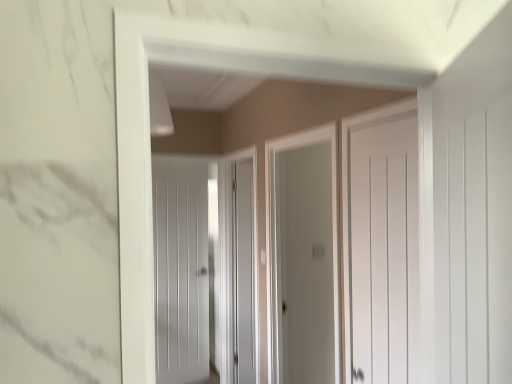
Question: Does white matte door at center, which is the 1th door in front-to-back order, appear on the left side of matte gray screen door at center, arranged as the 2th screen door when viewed from the front?

Choices:
 (A) no
 (B) yes

Answer: (A)

Question: Could matte gray screen door at center, arranged as the 2th screen door when viewed from the front, be considered to be inside white matte door at center, acting as the second door starting from the left?

Choices:
 (A) yes
 (B) no

Answer: (B)

Question: From the image's perspective, is white matte door at center, which is the 1th door in front-to-back order, located beneath matte gray screen door at center, which appears as the 1th screen door when viewed from the left?

Choices:
 (A) yes
 (B) no

Answer: (B)

Question: Can you confirm if white matte door at center, marked as the first door in a right-to-left arrangement, is thinner than matte gray screen door at center, which appears as the 1th screen door when viewed from the left?

Choices:
 (A) no
 (B) yes

Answer: (B)

Question: Is matte gray screen door at center, arranged as the 2th screen door when viewed from the front, at the back of white matte door at center, marked as the first door in a right-to-left arrangement?

Choices:
 (A) no
 (B) yes

Answer: (A)

Question: In the image, is matte gray screen door at center, which appears as the 1th screen door when viewed from the left, positioned in front of or behind white matte door at center, placed as the 2th door when sorted from back to front?

Choices:
 (A) behind
 (B) front

Answer: (A)

Question: Looking at their shapes, would you say matte gray screen door at center, placed as the first screen door when sorted from back to front, is wider or thinner than white matte door at center, which is the 1th door in front-to-back order?

Choices:
 (A) thin
 (B) wide

Answer: (B)

Question: Considering the positions of point (229, 276) and point (385, 349), is point (229, 276) closer or farther from the camera than point (385, 349)?

Choices:
 (A) farther
 (B) closer

Answer: (A)

Question: Looking at the image, does matte gray screen door at center, which appears as the 1th screen door when viewed from the left, seem bigger or smaller compared to white matte door at center, acting as the second door starting from the left?

Choices:
 (A) small
 (B) big

Answer: (B)

Question: Is point (415, 354) closer or farther from the camera than point (254, 243)?

Choices:
 (A) closer
 (B) farther

Answer: (A)

Question: From the image's perspective, is white matte door at center, which is the 1th door in front-to-back order, positioned above or below matte gray screen door at center, arranged as the 2th screen door when viewed from the front?

Choices:
 (A) above
 (B) below

Answer: (A)

Question: Visually, is white matte door at center, marked as the first door in a right-to-left arrangement, positioned to the left or to the right of matte gray screen door at center, marked as the 2th screen door in a right-to-left arrangement?

Choices:
 (A) right
 (B) left

Answer: (A)

Question: Is white matte door at center, acting as the second door starting from the left, in front of or behind matte gray screen door at center, which appears as the 1th screen door when viewed from the left, in the image?

Choices:
 (A) front
 (B) behind

Answer: (A)

Question: In the image, is matte gray screen door at center, placed as the first screen door when sorted from back to front, positioned in front of or behind clear glass door at center, acting as the 1th screen door starting from the front?

Choices:
 (A) behind
 (B) front

Answer: (A)

Question: From their relative heights in the image, would you say matte gray screen door at center, marked as the 2th screen door in a right-to-left arrangement, is taller or shorter than clear glass door at center, marked as the 2th screen door in a left-to-right arrangement?

Choices:
 (A) short
 (B) tall

Answer: (B)